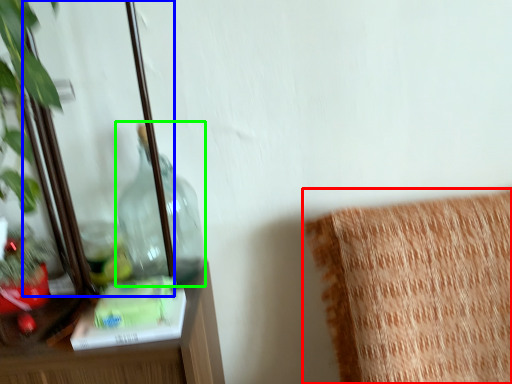
Question: Based on their relative distances, which object is farther from furniture (highlighted by a red box)? Choose from mirror (highlighted by a blue box) and bottle (highlighted by a green box).

Choices:
 (A) mirror
 (B) bottle

Answer: (A)